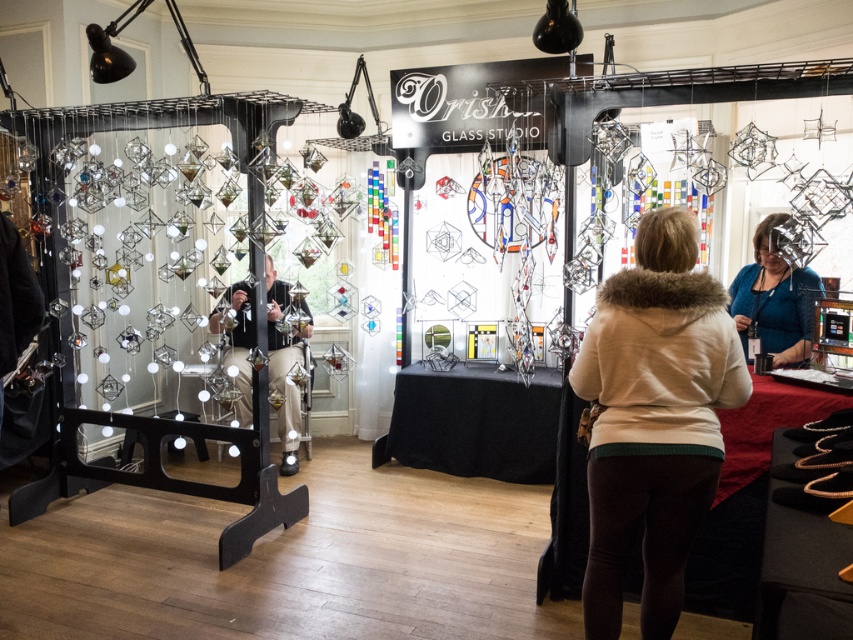
Question: Which object appears farthest from the camera in this image?

Choices:
 (A) matte black camera at center
 (B) matte glass ornament at right

Answer: (A)

Question: Does beige fur coat at center come in front of matte glass ornament at right?

Choices:
 (A) yes
 (B) no

Answer: (A)

Question: Which object is the closest to the matte black camera at center?

Choices:
 (A) matte glass ornament at right
 (B) beige fur coat at center

Answer: (B)

Question: Does matte glass ornament at right have a smaller size compared to matte black camera at center?

Choices:
 (A) yes
 (B) no

Answer: (A)

Question: Which of these objects is positioned closest to the matte black camera at center?

Choices:
 (A) beige fur coat at center
 (B) matte glass ornament at right

Answer: (A)

Question: Can you confirm if matte glass ornament at right is wider than matte black camera at center?

Choices:
 (A) yes
 (B) no

Answer: (B)